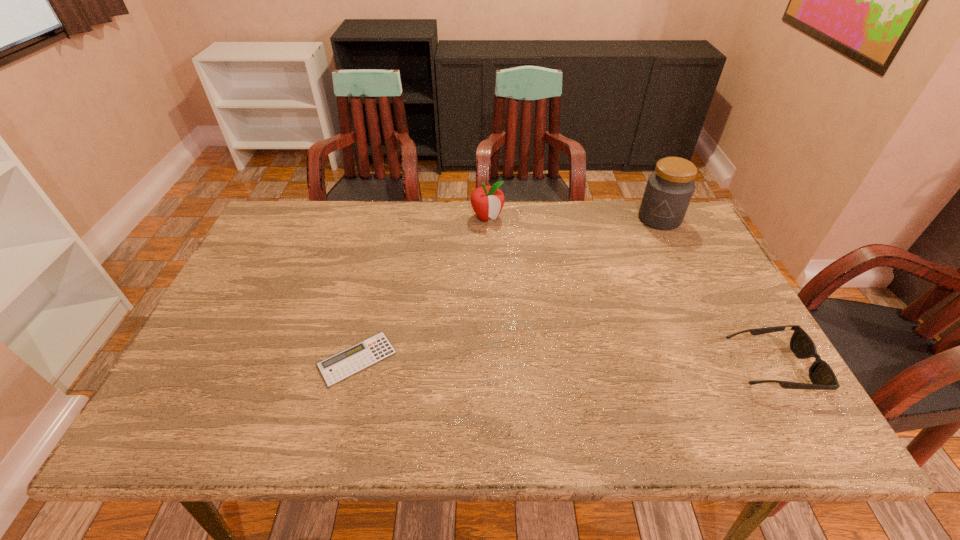
Identify the location of object positioned at the near right corner. (821, 375).

The height and width of the screenshot is (540, 960). In the image, there is a desktop. Identify the location of free space at the far edge. (477, 230).

At what (x,y) coordinates should I click in order to perform the action: click on free space at the near edge of the desktop. Please return your answer as a coordinate pair (x, y). The image size is (960, 540). Looking at the image, I should click on (510, 394).

This screenshot has height=540, width=960. In the image, there is a desktop. In order to click on free space at the left edge in this screenshot , I will do `click(279, 282)`.

In the image, there is a desktop. In order to click on vacant space at the right edge in this screenshot , I will do `click(698, 342)`.

In order to click on vacant space at the far left corner of the desktop in this screenshot , I will do coord(324,204).

In the image, there is a desktop. Identify the location of free region at the far right corner. The height and width of the screenshot is (540, 960). (678, 237).

Locate an element on the screen. The width and height of the screenshot is (960, 540). empty location between the calculator and the second shortest object is located at coordinates (564, 363).

At what (x,y) coordinates should I click in order to perform the action: click on vacant region between the second tallest object and the second shortest object. Please return your answer as a coordinate pair (x, y). The width and height of the screenshot is (960, 540). Looking at the image, I should click on (629, 292).

The width and height of the screenshot is (960, 540). What are the coordinates of `vacant space in between the shortest object and the sunglasses` in the screenshot? It's located at (564, 363).